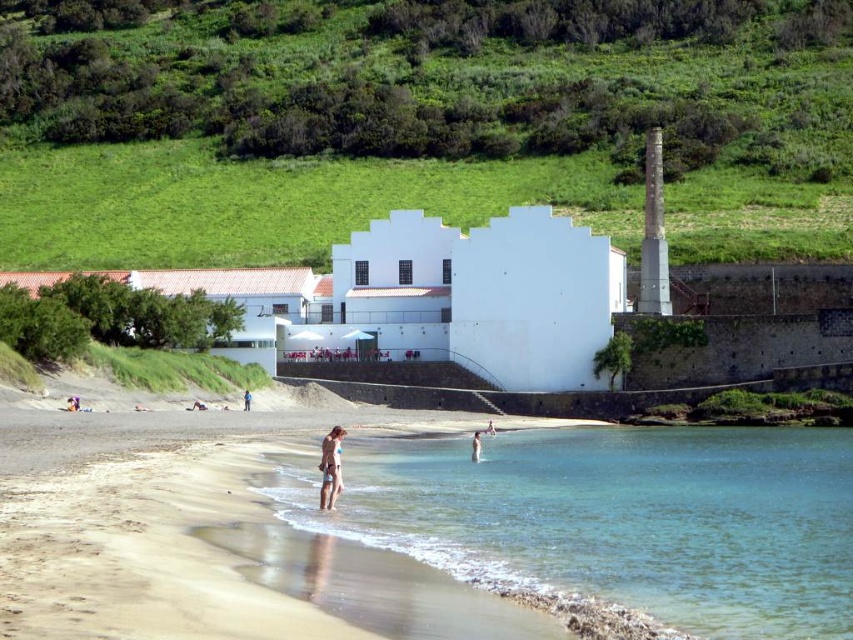
Question: Is tan skin person at lower center smaller than smooth skin person at lower center?

Choices:
 (A) no
 (B) yes

Answer: (A)

Question: Which point is closer to the camera taking this photo?

Choices:
 (A) (677, 532)
 (B) (289, 100)
 (C) (337, 440)
 (D) (473, 442)

Answer: (A)

Question: Which of the following is the closest to the observer?

Choices:
 (A) (107, 234)
 (B) (248, 400)
 (C) (491, 420)
 (D) (535, 499)

Answer: (D)

Question: Is green grass at upper center thinner than smooth skin person at lower center?

Choices:
 (A) yes
 (B) no

Answer: (B)

Question: Is green grass at upper center to the right of blue fabric person at center from the viewer's perspective?

Choices:
 (A) yes
 (B) no

Answer: (A)

Question: Which of these objects is positioned farthest from the beige fabric bikini at center?

Choices:
 (A) blue fabric person at center
 (B) clear water at beach center

Answer: (A)